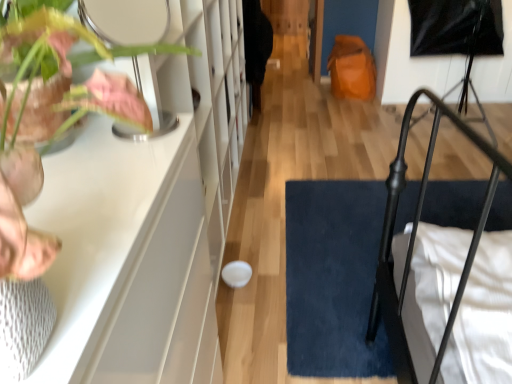
This screenshot has height=384, width=512. What do you see at coordinates (17, 134) in the screenshot? I see `matte pink leaf at left` at bounding box center [17, 134].

Find the location of a particular element. matte pink leaf at left is located at coordinates (17, 134).

Measure the distance between point (x=15, y=213) and camera.

Point (x=15, y=213) and camera are 25.10 centimeters apart.

This screenshot has height=384, width=512. What do you see at coordinates (337, 281) in the screenshot?
I see `dark blue plush doormat at lower right` at bounding box center [337, 281].

Image resolution: width=512 pixels, height=384 pixels. Identify the location of dark blue plush doormat at lower right. [337, 281].

Locate an element on the screen. The width and height of the screenshot is (512, 384). matte pink leaf at left is located at coordinates (17, 134).

Can you confirm if matte pink leaf at left is positioned to the left of dark blue plush doormat at lower right?

Indeed, matte pink leaf at left is positioned on the left side of dark blue plush doormat at lower right.

Considering the positions of objects matte pink leaf at left and dark blue plush doormat at lower right in the image provided, who is in front, matte pink leaf at left or dark blue plush doormat at lower right?

Positioned in front is matte pink leaf at left.

Which is behind, point (0, 250) or point (361, 305)?

The point (361, 305) is farther from the camera.

From the image's perspective, which is above, matte pink leaf at left or dark blue plush doormat at lower right?

matte pink leaf at left is shown above in the image.

From a real-world perspective, which is physically below, matte pink leaf at left or dark blue plush doormat at lower right?

From a 3D spatial view, dark blue plush doormat at lower right is below.

Between matte pink leaf at left and dark blue plush doormat at lower right, which one has larger width?

With larger width is dark blue plush doormat at lower right.

Between matte pink leaf at left and dark blue plush doormat at lower right, which one has more height?

matte pink leaf at left.

Which of these two, matte pink leaf at left or dark blue plush doormat at lower right, is bigger?

dark blue plush doormat at lower right.

Is matte pink leaf at left spatially inside dark blue plush doormat at lower right, or outside of it?

The correct answer is: outside.

Is matte pink leaf at left far from dark blue plush doormat at lower right?

Yes.

Is matte pink leaf at left looking in the opposite direction of dark blue plush doormat at lower right?

matte pink leaf at left is not turned away from dark blue plush doormat at lower right.

In the scene shown: Can you tell me how much matte pink leaf at left and dark blue plush doormat at lower right differ in facing direction?

85.6 degrees.

This screenshot has width=512, height=384. In order to click on houseplant in front of the dark blue plush doormat at lower right in this screenshot , I will do `click(17, 134)`.

From the picture: Which is more to the right, dark blue plush doormat at lower right or matte pink leaf at left?

dark blue plush doormat at lower right.

Considering the positions of objects dark blue plush doormat at lower right and matte pink leaf at left in the image provided, who is behind, dark blue plush doormat at lower right or matte pink leaf at left?

dark blue plush doormat at lower right is more distant.

Is point (327, 331) positioned before point (51, 19)?

No, it is behind (51, 19).

From the image's perspective, is dark blue plush doormat at lower right above matte pink leaf at left?

No, from the image's perspective, dark blue plush doormat at lower right is not over matte pink leaf at left.

From a real-world perspective, which is physically below, dark blue plush doormat at lower right or matte pink leaf at left?

dark blue plush doormat at lower right is physically lower.

Is dark blue plush doormat at lower right wider than matte pink leaf at left?

Indeed, dark blue plush doormat at lower right has a greater width compared to matte pink leaf at left.

From the picture: In terms of height, does dark blue plush doormat at lower right look taller or shorter compared to matte pink leaf at left?

dark blue plush doormat at lower right is shorter than matte pink leaf at left.

Does dark blue plush doormat at lower right have a smaller size compared to matte pink leaf at left?

No, dark blue plush doormat at lower right is not smaller than matte pink leaf at left.

Is dark blue plush doormat at lower right not within matte pink leaf at left?

Yes, dark blue plush doormat at lower right is not within matte pink leaf at left.

Is dark blue plush doormat at lower right not close to matte pink leaf at left?

dark blue plush doormat at lower right is positioned a significant distance from matte pink leaf at left.

Is dark blue plush doormat at lower right turned away from matte pink leaf at left?

No.

In the scene shown: How different are the orientations of dark blue plush doormat at lower right and matte pink leaf at left in degrees?

85.6 degrees separate the facing orientations of dark blue plush doormat at lower right and matte pink leaf at left.

Measure the distance from dark blue plush doormat at lower right to matte pink leaf at left.

4.61 feet.

The height and width of the screenshot is (384, 512). Identify the location of doormat below the matte pink leaf at left (from the image's perspective). (337, 281).

Identify the location of houseplant located above the dark blue plush doormat at lower right (from the image's perspective). This screenshot has width=512, height=384. (17, 134).

This screenshot has height=384, width=512. What are the coordinates of `houseplant above the dark blue plush doormat at lower right (from a real-world perspective)` in the screenshot? It's located at (17, 134).